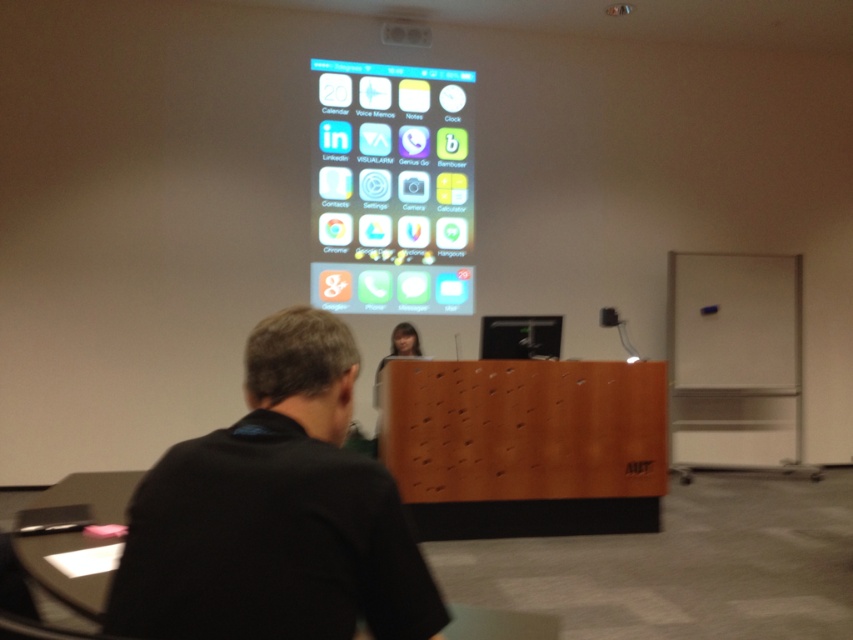
You are an event organizer checking the presentation setup. You notice the black fabric shirt at center and the black glossy computer screen at center. Which object is wider?

The black fabric shirt at center is wider than the black glossy computer screen at center according to the description.